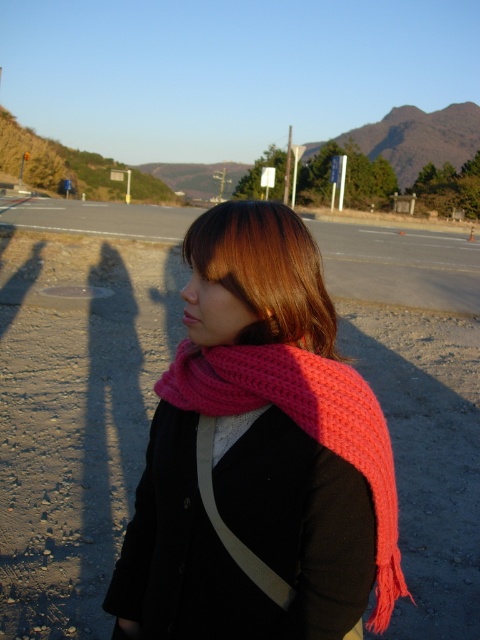
Consider the image. You are a photographer trying to capture the person in the scene. The pink knitted scarf at center and the brownwoollyhair at center are both visible in your camera frame. Which of these two items is positioned higher up in the image?

The pink knitted scarf at center is taller than brownwoollyhair at center, so it is positioned higher up in the image.

You are a photographer trying to capture a closeup shot of the pink knitted scarf at center and the brownwoollyhair at center. Your camera can only focus on objects within a 7 inch range. Will both objects be in focus?

The pink knitted scarf at center is 8.08 inches away from brownwoollyhair at center. Since the distance between them exceeds the camera focus range of 7 inches, only one of them will be in focus at a time.

You are standing at the point marked by coordinates point (302, 422) in the image. What object is located at that point?

The point (302, 422) marks the pink knitted scarf at center.